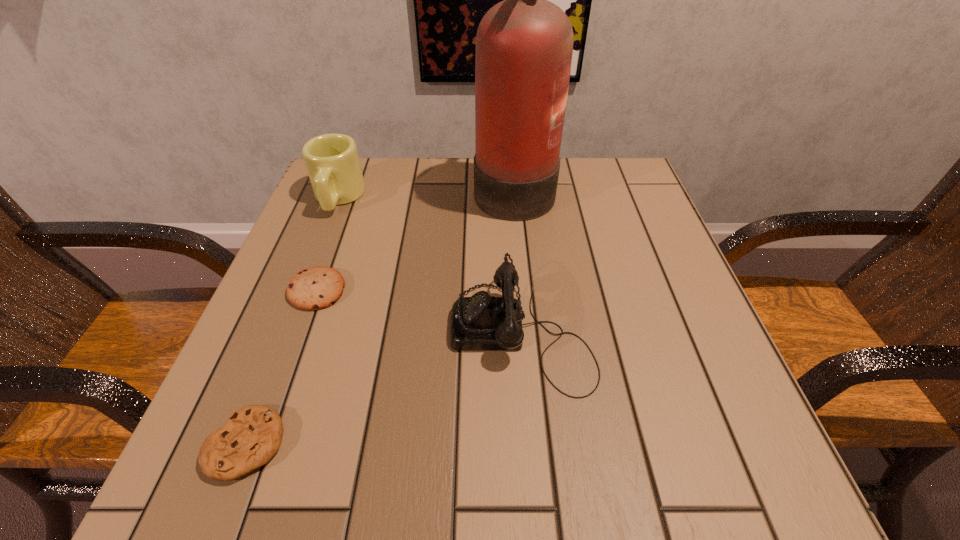
At what (x,y) coordinates should I click in order to perform the action: click on free spot that satisfies the following two spatial constraints: 1. at the nozzle of the tallest object; 2. with the handle on the side of the mug. Please return your answer as a coordinate pair (x, y). The image size is (960, 540). Looking at the image, I should click on (515, 198).